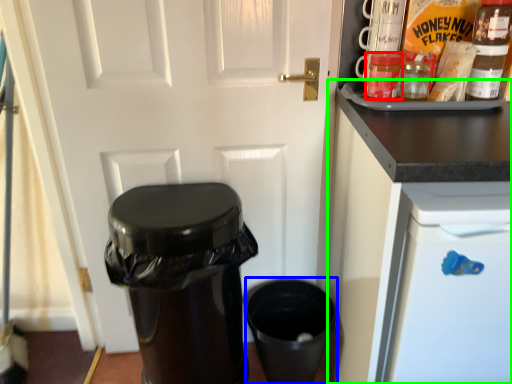
Question: Which is farther away from bottle (highlighted by a red box)? appliance (highlighted by a blue box) or cabinetry (highlighted by a green box)?

Choices:
 (A) appliance
 (B) cabinetry

Answer: (A)